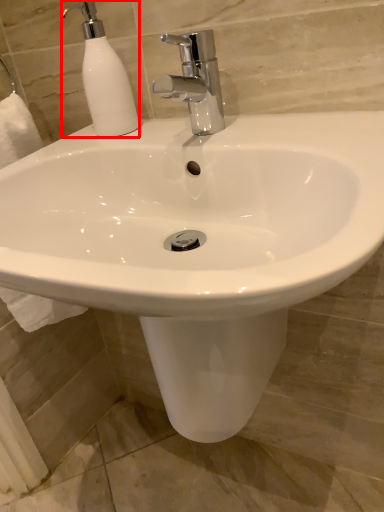
Question: From the image's perspective, where is soap dispenser (annotated by the red box) located in relation to tap in the image?

Choices:
 (A) below
 (B) above

Answer: (B)